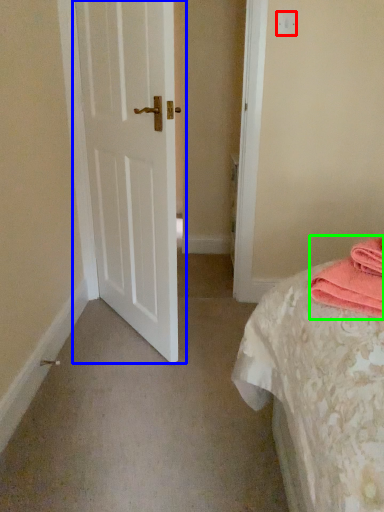
Question: Which object is positioned closest to light switch (highlighted by a red box)? Select from door (highlighted by a blue box) and material (highlighted by a green box).

Choices:
 (A) door
 (B) material

Answer: (A)